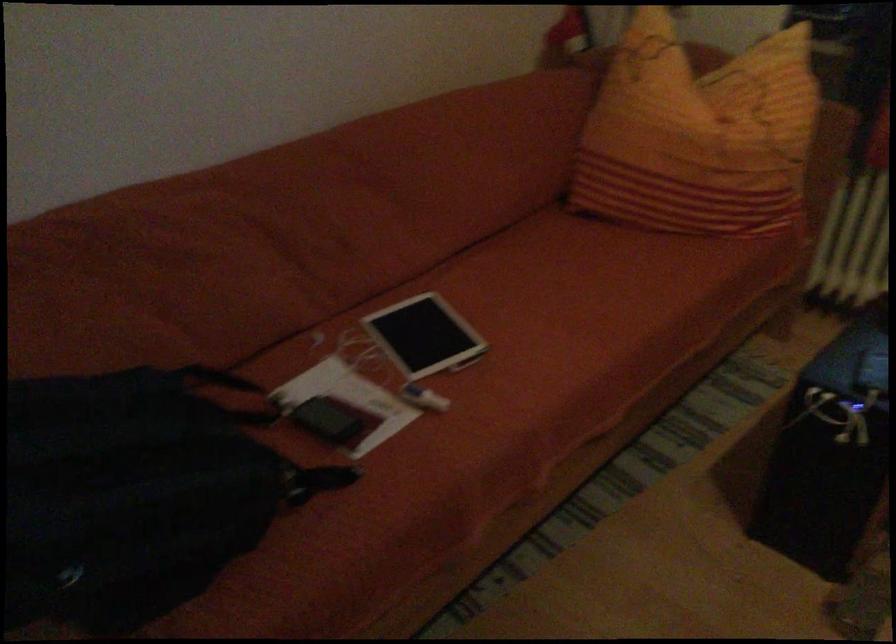
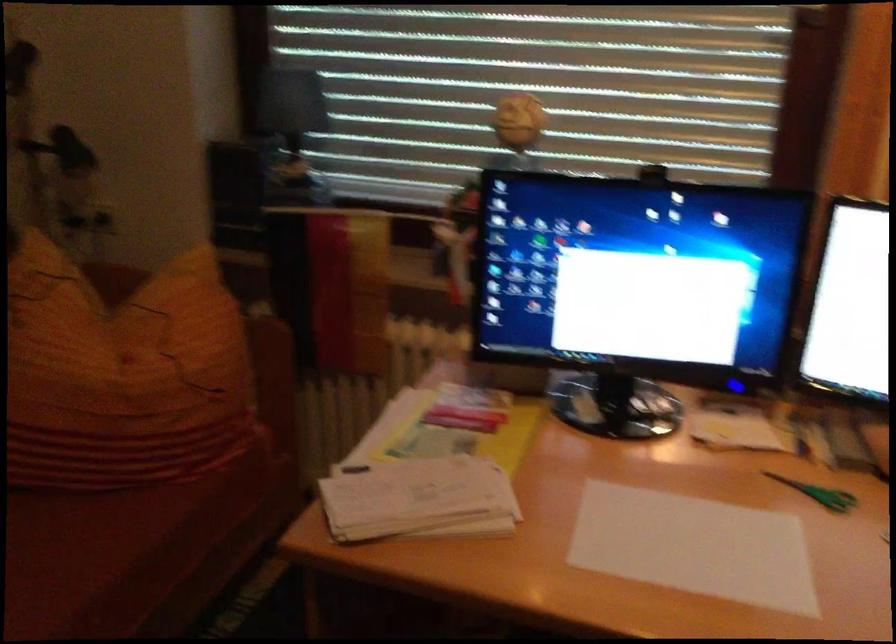
Question: The camera is either moving clockwise (left) or counter-clockwise (right) around the object. The first image is from the beginning of the video and the second image is from the end. Is the camera moving left or right when shooting the video?

Choices:
 (A) Left
 (B) Right

Answer: (A)